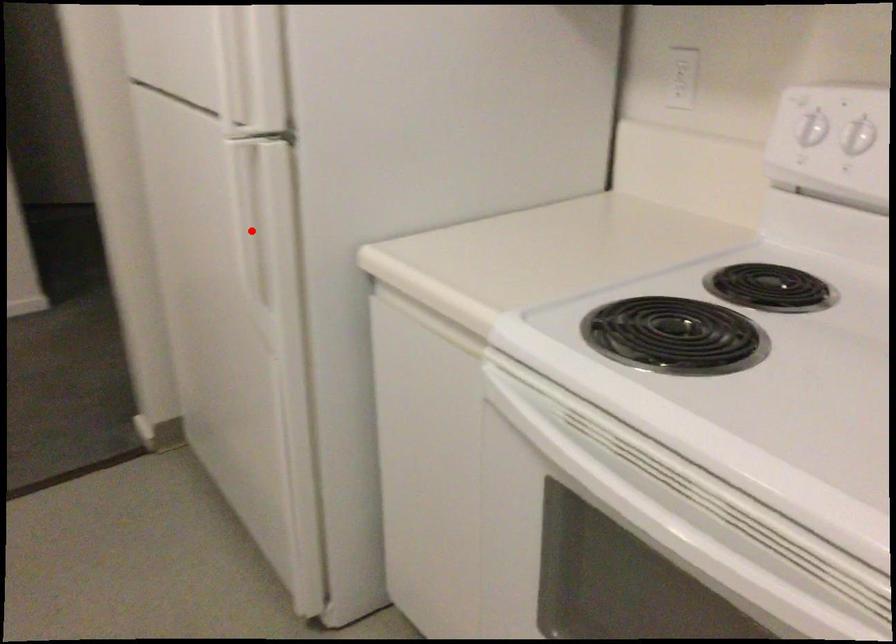
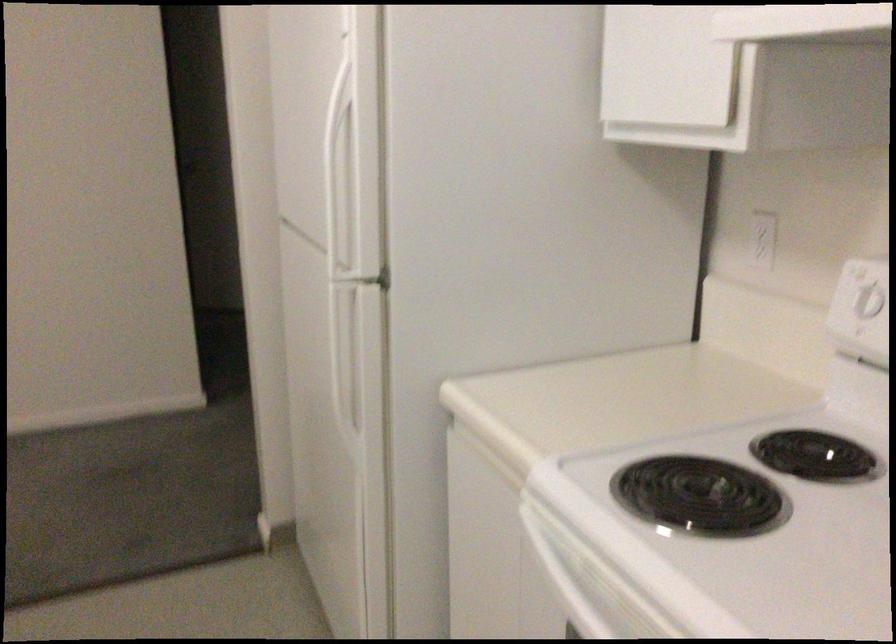
The point at the highlighted location is marked in the first image. Where is the corresponding point in the second image?

(349, 361)